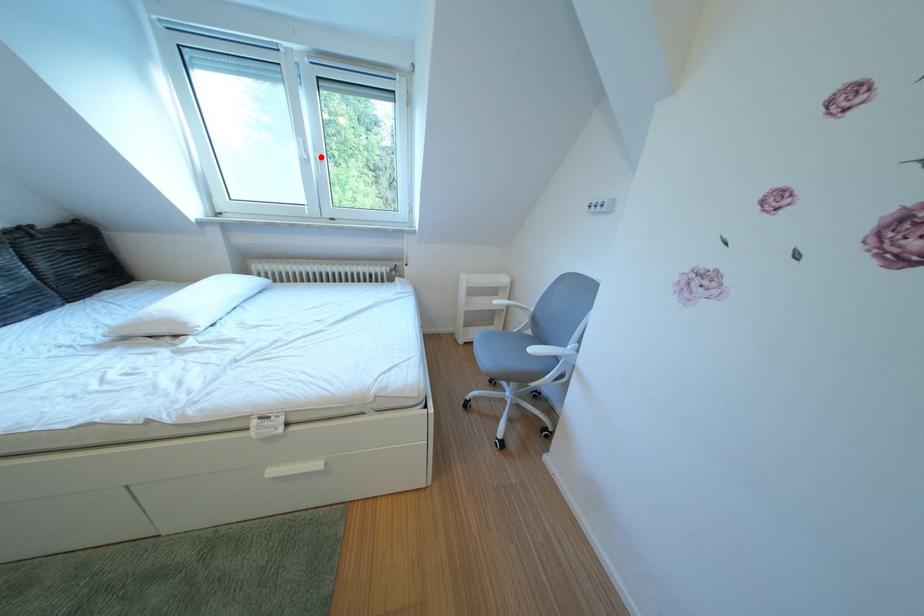
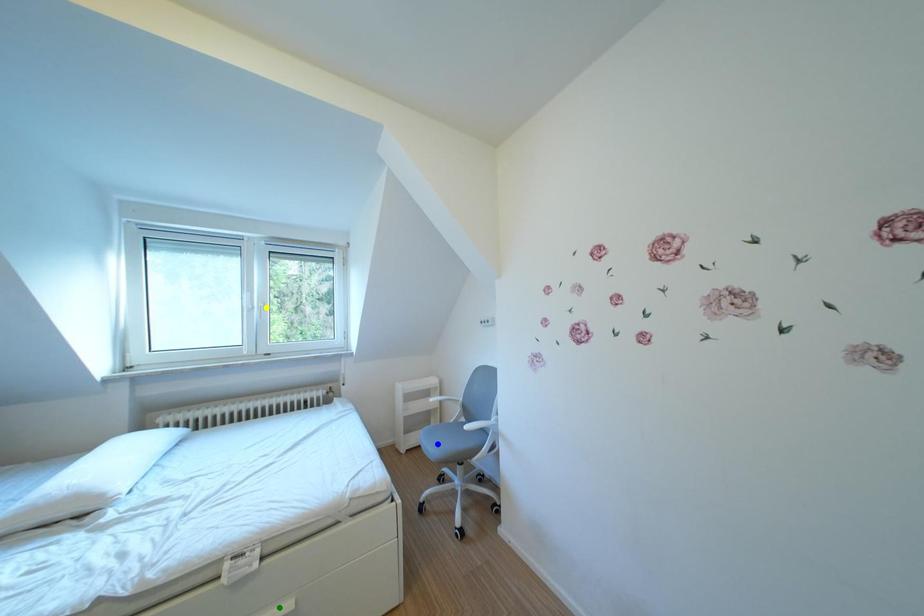
Question: I am providing you with two images of the same scene from different viewpoints. A red point is marked on the first image. You are given multiple points on the second image. Which point in image 2 is actually the same real-world point as the red point in image 1?

Choices:
 (A) green point
 (B) blue point
 (C) yellow point

Answer: (C)